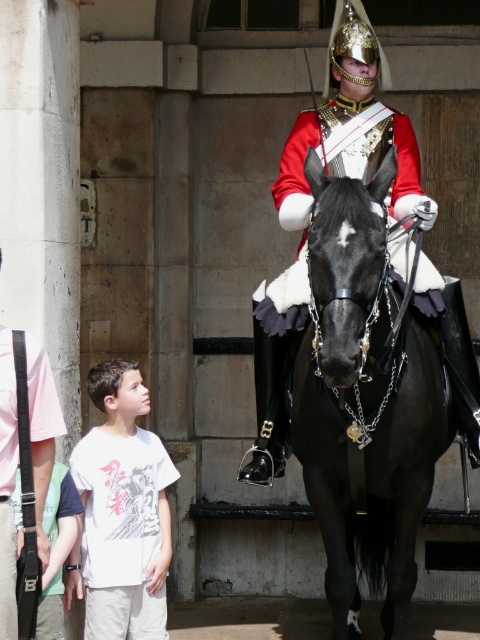
Question: Which point appears farthest from the camera in this image?

Choices:
 (A) (46, 387)
 (B) (412, 380)
 (C) (303, 317)
 (D) (128, 490)

Answer: (D)

Question: Can you confirm if black glossy horse at center is positioned to the left of white cotton t-shirt at lower left?

Choices:
 (A) no
 (B) yes

Answer: (A)

Question: Can you confirm if shiny black armor at center is bigger than white cotton t-shirt at lower left?

Choices:
 (A) no
 (B) yes

Answer: (B)

Question: Does shiny black armor at center appear over white cotton t-shirt at lower left?

Choices:
 (A) yes
 (B) no

Answer: (A)

Question: Which point is closer to the camera?

Choices:
 (A) black glossy horse at center
 (B) white cotton t-shirt at lower left
 (C) shiny black armor at center

Answer: (A)

Question: Estimate the real-world distances between objects in this image. Which object is farther from the white cotton t-shirt at lower left?

Choices:
 (A) black glossy horse at center
 (B) pink fabric bag at lower left

Answer: (B)